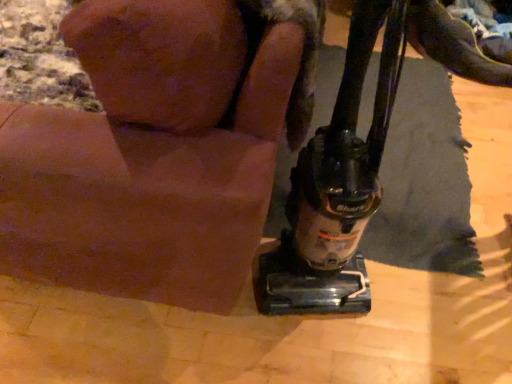
You are a GUI agent. You are given a task and a screenshot of the screen. Output one action in this format:
    pyautogui.click(x=<x>, y=<y>)
    Task: Click on the spots to the right of black plastic vacuum cleaner at lower right
    The height and width of the screenshot is (384, 512).
    Given the screenshot: What is the action you would take?
    pyautogui.click(x=417, y=296)